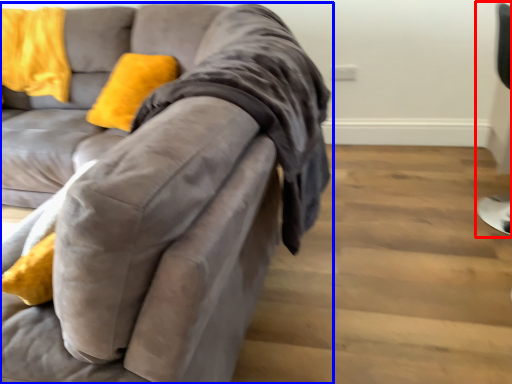
Question: Which of the following is the closest to the observer, computer chair (highlighted by a red box) or studio couch (highlighted by a blue box)?

Choices:
 (A) computer chair
 (B) studio couch

Answer: (B)